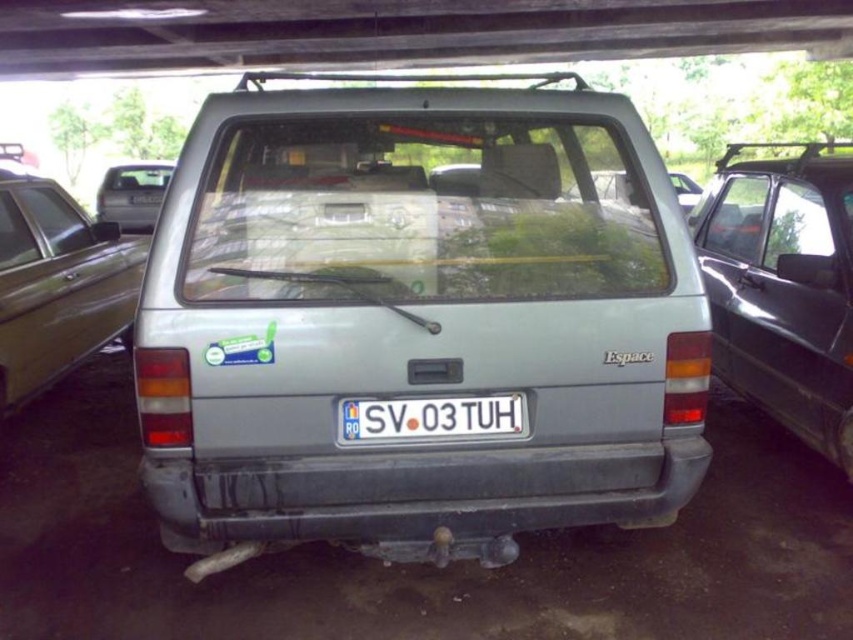
Does matte gray van at left have a smaller size compared to white plastic license plate at center?

No, matte gray van at left is not smaller than white plastic license plate at center.

Is matte gray van at left wider than white plastic license plate at center?

Yes.

The height and width of the screenshot is (640, 853). What do you see at coordinates (56, 282) in the screenshot?
I see `matte gray van at left` at bounding box center [56, 282].

Identify the location of matte gray van at left. Image resolution: width=853 pixels, height=640 pixels. (56, 282).

In order to click on gray matte bumper at center in this screenshot , I will do `click(419, 496)`.

Does gray matte bumper at center appear on the left side of matte silver van at center?

No, gray matte bumper at center is not to the left of matte silver van at center.

You are a GUI agent. You are given a task and a screenshot of the screen. Output one action in this format:
    pyautogui.click(x=<x>, y=<y>)
    Task: Click on the gray matte bumper at center
    
    Given the screenshot: What is the action you would take?
    pyautogui.click(x=419, y=496)

Between satin silver van at center and matte gray van at left, which one appears on the left side from the viewer's perspective?

matte gray van at left is more to the left.

Which of these two, satin silver van at center or matte gray van at left, stands taller?

satin silver van at center is taller.

Is point (569, 364) more distant than point (73, 275)?

No, it is in front of (73, 275).

The height and width of the screenshot is (640, 853). Find the location of `satin silver van at center`. satin silver van at center is located at coordinates (416, 320).